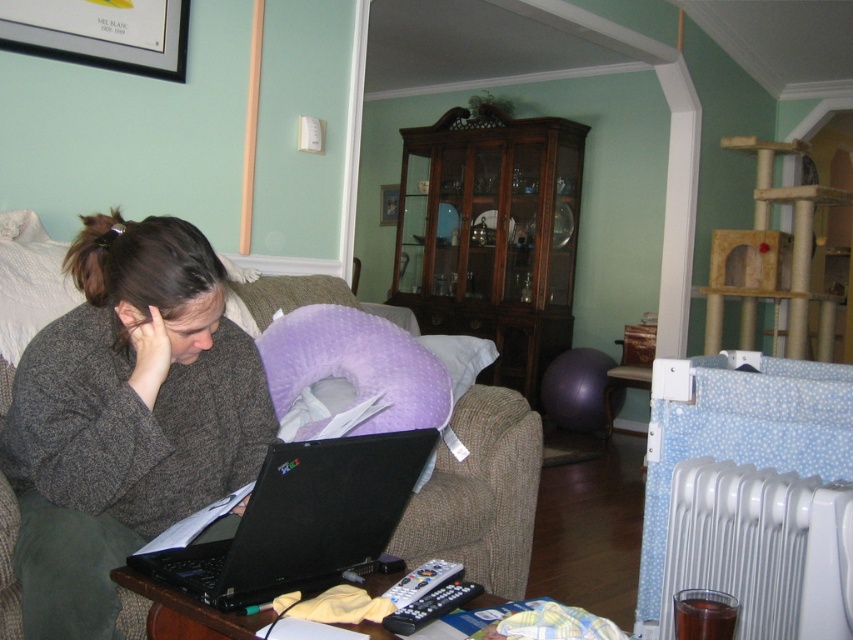
Question: Is brown fabric couch at center thinner than black matte laptop at lower center?

Choices:
 (A) no
 (B) yes

Answer: (B)

Question: Which of the following is the closest to the observer?

Choices:
 (A) dark gray sweater at center
 (B) white plastic radiator at lower right
 (C) black matte laptop at lower center

Answer: (C)

Question: Is black matte laptop at lower center to the right of white plastic radiator at lower right from the viewer's perspective?

Choices:
 (A) yes
 (B) no

Answer: (B)

Question: Which point is farther from the camera taking this photo?

Choices:
 (A) (699, 536)
 (B) (425, 340)
 (C) (80, 595)
 (D) (219, 564)

Answer: (B)

Question: Is brown fabric couch at center closer to camera compared to black matte laptop at lower center?

Choices:
 (A) no
 (B) yes

Answer: (A)

Question: Which of the following is the farthest from the observer?

Choices:
 (A) (840, 602)
 (B) (260, 508)
 (C) (463, 416)
 (D) (236, 365)

Answer: (C)